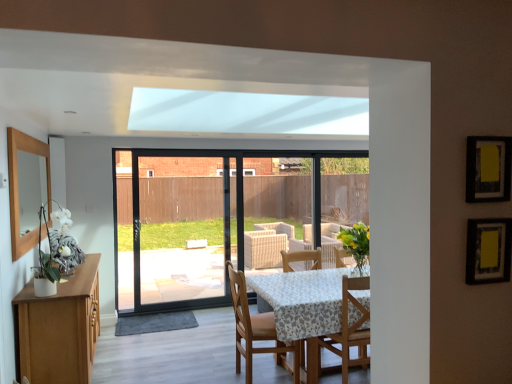
Question: Is wooden chair at center, which is counted as the second chair, starting from the left, a part of wooden chair at center, the 1th chair viewed from the left?

Choices:
 (A) yes
 (B) no

Answer: (B)

Question: From a real-world perspective, is wooden chair at center, the 2th chair positioned from the right, over wooden chair at center, which is counted as the second chair, starting from the left?

Choices:
 (A) yes
 (B) no

Answer: (B)

Question: Does wooden chair at center, the 2th chair positioned from the right, have a greater height compared to wooden chair at center, placed as the 1th chair when sorted from right to left?

Choices:
 (A) no
 (B) yes

Answer: (B)

Question: Is wooden chair at center, the 1th chair viewed from the left, smaller than wooden chair at center, placed as the 1th chair when sorted from right to left?

Choices:
 (A) no
 (B) yes

Answer: (A)

Question: Does wooden chair at center, the 2th chair positioned from the right, appear on the right side of wooden chair at center, placed as the 1th chair when sorted from right to left?

Choices:
 (A) no
 (B) yes

Answer: (A)

Question: Is wooden chair at center, the 2th chair positioned from the right, located outside wooden chair at center, placed as the 1th chair when sorted from right to left?

Choices:
 (A) yes
 (B) no

Answer: (A)

Question: Is wooden chair at center, which is counted as the second chair, starting from the left, positioned in front of wooden chair at center, the 1th chair viewed from the left?

Choices:
 (A) yes
 (B) no

Answer: (A)

Question: From the image's perspective, would you say wooden chair at center, placed as the 1th chair when sorted from right to left, is positioned over wooden chair at center, the 2th chair positioned from the right?

Choices:
 (A) no
 (B) yes

Answer: (B)

Question: Considering the relative sizes of wooden chair at center, placed as the 1th chair when sorted from right to left, and wooden chair at center, the 2th chair positioned from the right, in the image provided, is wooden chair at center, placed as the 1th chair when sorted from right to left, taller than wooden chair at center, the 2th chair positioned from the right,?

Choices:
 (A) yes
 (B) no

Answer: (B)

Question: Considering the relative positions of wooden chair at center, placed as the 1th chair when sorted from right to left, and wooden chair at center, the 1th chair viewed from the left, in the image provided, is wooden chair at center, placed as the 1th chair when sorted from right to left, to the right of wooden chair at center, the 1th chair viewed from the left, from the viewer's perspective?

Choices:
 (A) no
 (B) yes

Answer: (B)

Question: Considering the relative sizes of wooden chair at center, placed as the 1th chair when sorted from right to left, and wooden chair at center, the 2th chair positioned from the right, in the image provided, is wooden chair at center, placed as the 1th chair when sorted from right to left, wider than wooden chair at center, the 2th chair positioned from the right,?

Choices:
 (A) yes
 (B) no

Answer: (B)

Question: Does wooden chair at center, placed as the 1th chair when sorted from right to left, have a lesser width compared to wooden chair at center, the 1th chair viewed from the left?

Choices:
 (A) no
 (B) yes

Answer: (B)

Question: From a real-world perspective, relative to wooden chair at center, the 1th chair viewed from the left, is wooden chair at center, placed as the 1th chair when sorted from right to left, vertically above or below?

Choices:
 (A) below
 (B) above

Answer: (B)